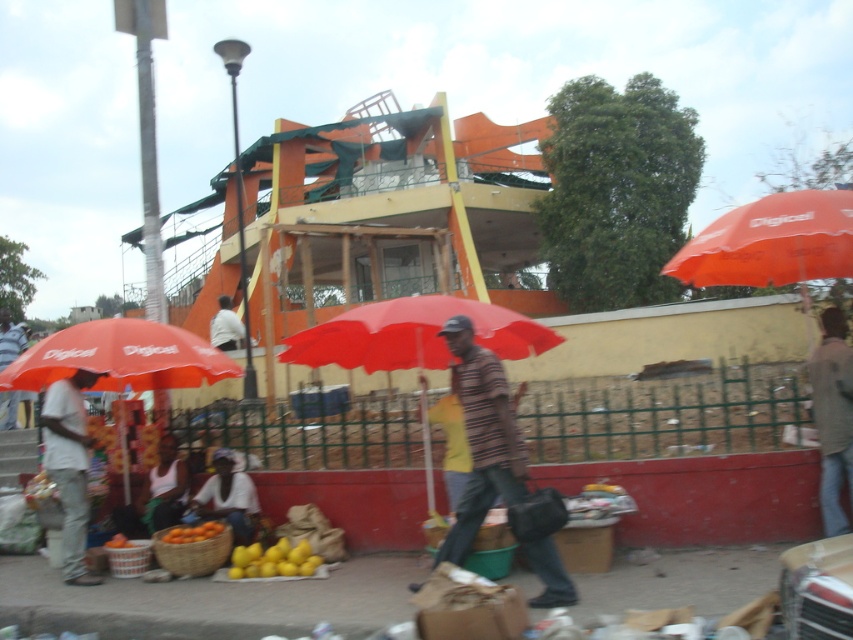
Question: Which point is closer to the camera?

Choices:
 (A) (282, 540)
 (B) (64, 445)
 (C) (187, 513)
 (D) (143, 515)

Answer: (B)

Question: Can you confirm if striped fabric shirt at center is thinner than yellow fabric bag at lower center?

Choices:
 (A) yes
 (B) no

Answer: (B)

Question: Which point appears closest to the camera in this image?

Choices:
 (A) (178, 508)
 (B) (196, 515)
 (C) (291, 557)

Answer: (C)

Question: Is red fabric umbrella at left above green fabric shirt at lower left?

Choices:
 (A) no
 (B) yes

Answer: (B)

Question: Which is nearer to the green fabric shirt at lower left?

Choices:
 (A) orange matte at lower left
 (B) yellow fabric bag at lower center
 (C) yellow matte lemons at center
 (D) light brown fabric shirt at lower left

Answer: (B)

Question: Can you confirm if denim jacket at lower right is smaller than orange matte at lower left?

Choices:
 (A) yes
 (B) no

Answer: (B)